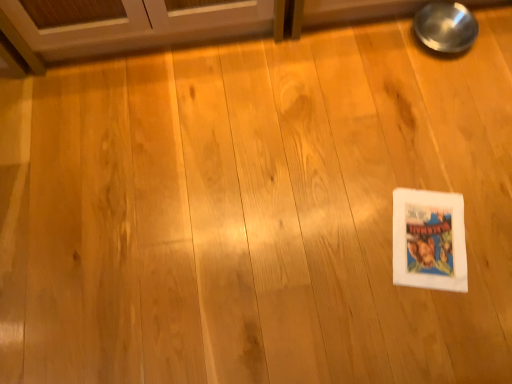
Question: Are metallic reflective bowl at upper right and white paper comic book at lower right making contact?

Choices:
 (A) no
 (B) yes

Answer: (A)

Question: Is metallic reflective bowl at upper right to the right of white paper comic book at lower right from the viewer's perspective?

Choices:
 (A) yes
 (B) no

Answer: (A)

Question: Is metallic reflective bowl at upper right at the left side of white paper comic book at lower right?

Choices:
 (A) yes
 (B) no

Answer: (B)

Question: Is metallic reflective bowl at upper right closer to camera compared to white paper comic book at lower right?

Choices:
 (A) no
 (B) yes

Answer: (A)

Question: Does metallic reflective bowl at upper right turn towards white paper comic book at lower right?

Choices:
 (A) yes
 (B) no

Answer: (A)

Question: Is metallic reflective bowl at upper right smaller than white paper comic book at lower right?

Choices:
 (A) yes
 (B) no

Answer: (B)

Question: Is white paper comic book at lower right at the right side of metallic reflective bowl at upper right?

Choices:
 (A) no
 (B) yes

Answer: (A)

Question: Is white paper comic book at lower right facing away from metallic reflective bowl at upper right?

Choices:
 (A) no
 (B) yes

Answer: (A)

Question: Is metallic reflective bowl at upper right a part of white paper comic book at lower right?

Choices:
 (A) no
 (B) yes

Answer: (A)

Question: Is white paper comic book at lower right not within metallic reflective bowl at upper right?

Choices:
 (A) no
 (B) yes

Answer: (B)

Question: Considering the relative sizes of white paper comic book at lower right and metallic reflective bowl at upper right in the image provided, is white paper comic book at lower right thinner than metallic reflective bowl at upper right?

Choices:
 (A) no
 (B) yes

Answer: (A)

Question: Considering the relative positions of white paper comic book at lower right and metallic reflective bowl at upper right in the image provided, is white paper comic book at lower right in front of metallic reflective bowl at upper right?

Choices:
 (A) yes
 (B) no

Answer: (A)

Question: Is point (421, 208) closer or farther from the camera than point (466, 14)?

Choices:
 (A) farther
 (B) closer

Answer: (B)